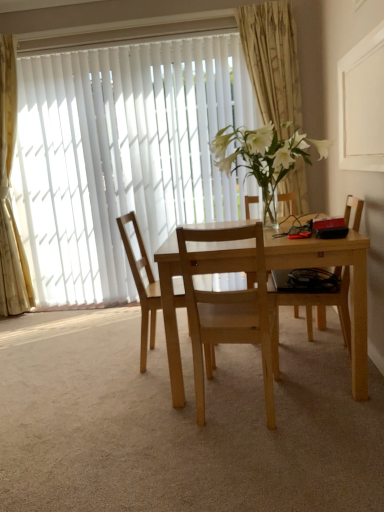
This screenshot has height=512, width=384. Find the location of `natural wood chair at center, placed as the 3th chair when sorted from right to left`. natural wood chair at center, placed as the 3th chair when sorted from right to left is located at coordinates (141, 281).

Describe the element at coordinates (351, 285) in the screenshot. I see `light wood table at center` at that location.

The image size is (384, 512). What do you see at coordinates (329, 305) in the screenshot?
I see `light wood chair at right, placed as the 3th chair when sorted from left to right` at bounding box center [329, 305].

What do you see at coordinates (226, 305) in the screenshot? The height and width of the screenshot is (512, 384). I see `light wood chair at center, which is the second chair in right-to-left order` at bounding box center [226, 305].

Image resolution: width=384 pixels, height=512 pixels. In order to click on natural wood chair at center, placed as the 3th chair when sorted from right to left in this screenshot , I will do `click(141, 281)`.

Measure the distance between light wood table at center and gold textured curtain at upper center, marked as the 2th curtain in a left-to-right arrangement.

The distance of light wood table at center from gold textured curtain at upper center, marked as the 2th curtain in a left-to-right arrangement, is 1.56 meters.

Looking at the image, does light wood table at center seem bigger or smaller compared to gold textured curtain at upper center, marked as the first curtain in a right-to-left arrangement?

Clearly, light wood table at center is larger in size than gold textured curtain at upper center, marked as the first curtain in a right-to-left arrangement.

Considering their positions, is light wood table at center located in front of or behind gold textured curtain at upper center, marked as the first curtain in a right-to-left arrangement?

light wood table at center is in front of gold textured curtain at upper center, marked as the first curtain in a right-to-left arrangement.

From the picture: Would you say light wood table at center is outside gold textured curtain at upper center, marked as the first curtain in a right-to-left arrangement?

Yes, light wood table at center is not within gold textured curtain at upper center, marked as the first curtain in a right-to-left arrangement.

From the picture: Measure the distance between white vertical blinds at upper left and white sheer curtain at left, the second curtain from the right.

white vertical blinds at upper left and white sheer curtain at left, the second curtain from the right, are 72.56 centimeters apart from each other.

Is point (122, 112) farther from camera compared to point (11, 55)?

That is True.

From the image's perspective, which one is positioned higher, white vertical blinds at upper left or white sheer curtain at left, the second curtain from the right?

white vertical blinds at upper left, from the image's perspective.

I want to click on curtain lying below the white vertical blinds at upper left (from the image's perspective), so click(x=10, y=195).

Where is `the 1st chair to the right of the white vertical blinds at upper left, starting your count from the anchor`? The height and width of the screenshot is (512, 384). the 1st chair to the right of the white vertical blinds at upper left, starting your count from the anchor is located at coordinates (141, 281).

What's the angular difference between white vertical blinds at upper left and natural wood chair at center, the first chair in the left-to-right sequence,'s facing directions?

85.9 degrees.

Is natural wood chair at center, placed as the 3th chair when sorted from right to left, at the back of white vertical blinds at upper left?

No, white vertical blinds at upper left's orientation is not away from natural wood chair at center, placed as the 3th chair when sorted from right to left.

Which of these two, white vertical blinds at upper left or natural wood chair at center, placed as the 3th chair when sorted from right to left, stands taller?

Standing taller between the two is white vertical blinds at upper left.

From a real-world perspective, which is physically above, natural wood chair at center, the first chair in the left-to-right sequence, or gold textured curtain at upper center, marked as the 2th curtain in a left-to-right arrangement?

gold textured curtain at upper center, marked as the 2th curtain in a left-to-right arrangement, is physically above.

Considering the sizes of objects natural wood chair at center, the first chair in the left-to-right sequence, and gold textured curtain at upper center, marked as the first curtain in a right-to-left arrangement, in the image provided, who is bigger, natural wood chair at center, the first chair in the left-to-right sequence, or gold textured curtain at upper center, marked as the first curtain in a right-to-left arrangement,?

With larger size is natural wood chair at center, the first chair in the left-to-right sequence.

Are natural wood chair at center, the first chair in the left-to-right sequence, and gold textured curtain at upper center, marked as the 2th curtain in a left-to-right arrangement, far apart?

Yes.

How many degrees apart are the facing directions of white vertical blinds at upper left and gold textured curtain at upper center, marked as the 2th curtain in a left-to-right arrangement?

0.919 degrees.

Considering the positions of objects white vertical blinds at upper left and gold textured curtain at upper center, marked as the 2th curtain in a left-to-right arrangement, in the image provided, who is in front, white vertical blinds at upper left or gold textured curtain at upper center, marked as the 2th curtain in a left-to-right arrangement,?

Positioned in front is gold textured curtain at upper center, marked as the 2th curtain in a left-to-right arrangement.

Considering the sizes of objects white vertical blinds at upper left and gold textured curtain at upper center, marked as the first curtain in a right-to-left arrangement, in the image provided, who is taller, white vertical blinds at upper left or gold textured curtain at upper center, marked as the first curtain in a right-to-left arrangement,?

With more height is white vertical blinds at upper left.

Is white vertical blinds at upper left facing towards gold textured curtain at upper center, marked as the 2th curtain in a left-to-right arrangement?

Yes.

Is natural wood chair at center, placed as the 3th chair when sorted from right to left, facing away from white sheer curtain at left, the first curtain viewed from the left?

No, white sheer curtain at left, the first curtain viewed from the left, is not at the back of natural wood chair at center, placed as the 3th chair when sorted from right to left.

Is natural wood chair at center, placed as the 3th chair when sorted from right to left, taller than white sheer curtain at left, the second curtain from the right?

No, natural wood chair at center, placed as the 3th chair when sorted from right to left, is not taller than white sheer curtain at left, the second curtain from the right.

Is natural wood chair at center, the first chair in the left-to-right sequence, far from white sheer curtain at left, the first curtain viewed from the left?

Yes, natural wood chair at center, the first chair in the left-to-right sequence, and white sheer curtain at left, the first curtain viewed from the left, are located far from each other.

Is light wood table at center not near natural wood chair at center, placed as the 3th chair when sorted from right to left?

No, light wood table at center is not far away from natural wood chair at center, placed as the 3th chair when sorted from right to left.

Considering the positions of point (352, 336) and point (132, 274), is point (352, 336) closer or farther from the camera than point (132, 274)?

Clearly, point (352, 336) is closer to the camera than point (132, 274).

Considering the sizes of light wood table at center and natural wood chair at center, the first chair in the left-to-right sequence, in the image, is light wood table at center wider or thinner than natural wood chair at center, the first chair in the left-to-right sequence,?

Clearly, light wood table at center has more width compared to natural wood chair at center, the first chair in the left-to-right sequence.

Does light wood table at center lie in front of natural wood chair at center, placed as the 3th chair when sorted from right to left?

Yes, light wood table at center is closer to the camera.

Locate an element on the screen. kitchen & dining room table lying on the left of gold textured curtain at upper center, marked as the first curtain in a right-to-left arrangement is located at coordinates (351, 285).

There is a white vertical blinds at upper left. Where is `the 1st curtain above it (from a real-world perspective)`? the 1st curtain above it (from a real-world perspective) is located at coordinates (10, 195).

Consider the image. Based on their spatial positions, is gold textured curtain at upper center, marked as the 2th curtain in a left-to-right arrangement, or light wood chair at right, placed as the 3th chair when sorted from left to right, further from light wood chair at center, the second chair viewed from the left?

gold textured curtain at upper center, marked as the 2th curtain in a left-to-right arrangement, is further to light wood chair at center, the second chair viewed from the left.

Considering their positions, is white vertical blinds at upper left positioned further to gold textured curtain at upper center, marked as the 2th curtain in a left-to-right arrangement, than light wood chair at right, placed as the 3th chair when sorted from left to right?

Among the two, light wood chair at right, placed as the 3th chair when sorted from left to right, is located further to gold textured curtain at upper center, marked as the 2th curtain in a left-to-right arrangement.

From the image, which object appears to be nearer to white vertical blinds at upper left, light wood table at center or light wood chair at right, placed as the 3th chair when sorted from left to right?

light wood table at center.

When comparing their distances from natural wood chair at center, placed as the 3th chair when sorted from right to left, does light wood table at center or white sheer curtain at left, the first curtain viewed from the left, seem closer?

light wood table at center is positioned closer to the anchor natural wood chair at center, placed as the 3th chair when sorted from right to left.

When comparing their distances from gold textured curtain at upper center, marked as the first curtain in a right-to-left arrangement, does light wood table at center or light wood chair at right, placed as the 3th chair when sorted from left to right, seem further?

Among the two, light wood table at center is located further to gold textured curtain at upper center, marked as the first curtain in a right-to-left arrangement.

From the image, which object appears to be farther from light wood chair at right, the 1th chair viewed from the right, white sheer curtain at left, the first curtain viewed from the left, or light wood table at center?

white sheer curtain at left, the first curtain viewed from the left, is positioned further to the anchor light wood chair at right, the 1th chair viewed from the right.

Considering their positions, is white sheer curtain at left, the second curtain from the right, positioned closer to light wood chair at center, which is the second chair in right-to-left order, than white vertical blinds at upper left?

white vertical blinds at upper left.

Based on their spatial positions, is gold textured curtain at upper center, marked as the first curtain in a right-to-left arrangement, or natural wood chair at center, the first chair in the left-to-right sequence, closer to light wood chair at right, the 1th chair viewed from the right?

natural wood chair at center, the first chair in the left-to-right sequence, lies closer to light wood chair at right, the 1th chair viewed from the right, than the other object.

Find the location of a particular element. kitchen & dining room table situated between white sheer curtain at left, the first curtain viewed from the left, and light wood chair at right, the 1th chair viewed from the right, from left to right is located at coordinates (351, 285).

Where is `kitchen & dining room table situated between light wood chair at center, the second chair viewed from the left, and light wood chair at right, the 1th chair viewed from the right, from left to right`? kitchen & dining room table situated between light wood chair at center, the second chair viewed from the left, and light wood chair at right, the 1th chair viewed from the right, from left to right is located at coordinates (351, 285).

Image resolution: width=384 pixels, height=512 pixels. What are the coordinates of `window between white sheer curtain at left, the first curtain viewed from the left, and light wood table at center, in the horizontal direction` in the screenshot? It's located at (122, 156).

Locate an element on the screen. window between gold textured curtain at upper center, marked as the first curtain in a right-to-left arrangement, and natural wood chair at center, the first chair in the left-to-right sequence, in the vertical direction is located at coordinates (122, 156).